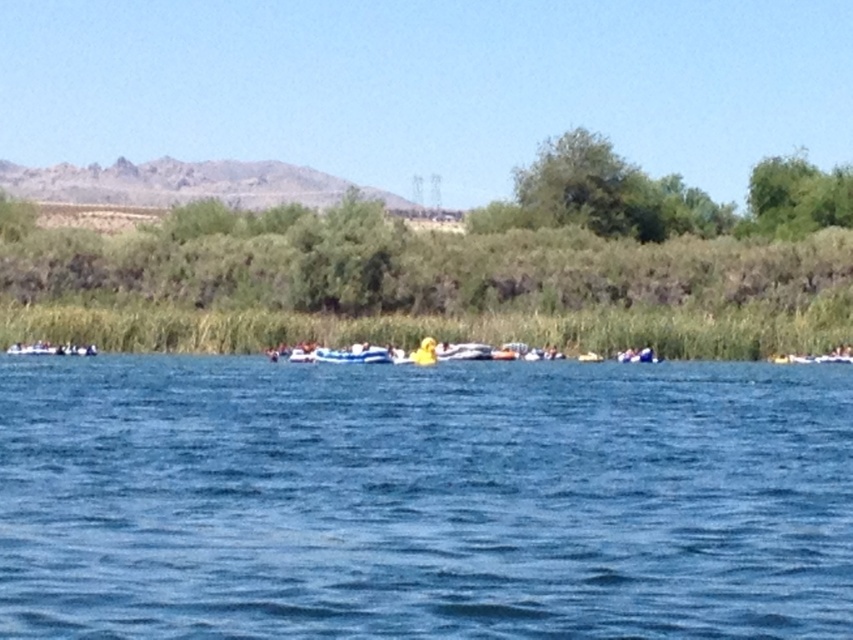
You are standing on the shore of the lake and see the blue water at center and the yellow rubber boat at center. Which object is closer to you?

The yellow rubber boat at center is closer to you because it is above the blue water at center.

You are standing at the point marked as point (422, 499) in the image. What is the color of the water at that location?

The point (422, 499) marks blue water at center, so the color of the water at that location is blue.